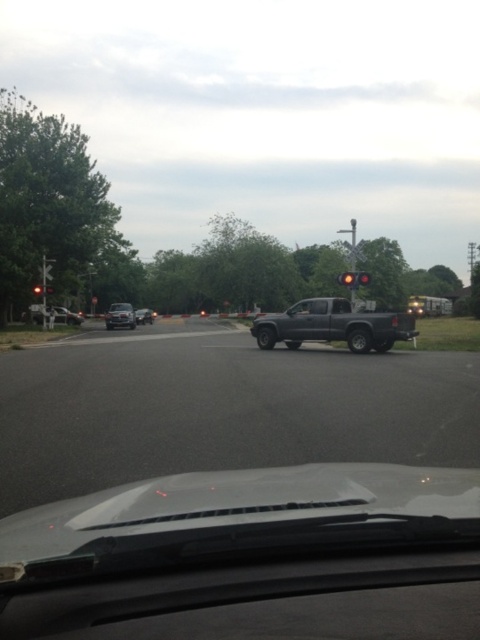
Can you confirm if dark gray matte truck at center is bigger than shiny black sedan at center?

Actually, dark gray matte truck at center might be smaller than shiny black sedan at center.

Can you confirm if dark gray matte truck at center is smaller than shiny black sedan at center?

Indeed, dark gray matte truck at center has a smaller size compared to shiny black sedan at center.

Who is more distant from viewer, [296,332] or [151,314]?

The point [151,314] is behind.

Where is `dark gray matte truck at center`? Image resolution: width=480 pixels, height=640 pixels. dark gray matte truck at center is located at coordinates (333, 324).

Can you confirm if transparent plastic windshield at center is thinner than shiny black sedan at center?

Indeed, transparent plastic windshield at center has a lesser width compared to shiny black sedan at center.

Between transparent plastic windshield at center and shiny black sedan at center, which one appears on the right side from the viewer's perspective?

From the viewer's perspective, transparent plastic windshield at center appears more on the right side.

Describe the element at coordinates (309, 307) in the screenshot. I see `transparent plastic windshield at center` at that location.

The image size is (480, 640). I want to click on transparent plastic windshield at center, so click(x=309, y=307).

Does dark gray matte truck at center come behind matte silver sedan at left?

That is False.

Does dark gray matte truck at center appear under matte silver sedan at left?

Indeed, dark gray matte truck at center is positioned under matte silver sedan at left.

Find the location of a particular element. The image size is (480, 640). dark gray matte truck at center is located at coordinates point(333,324).